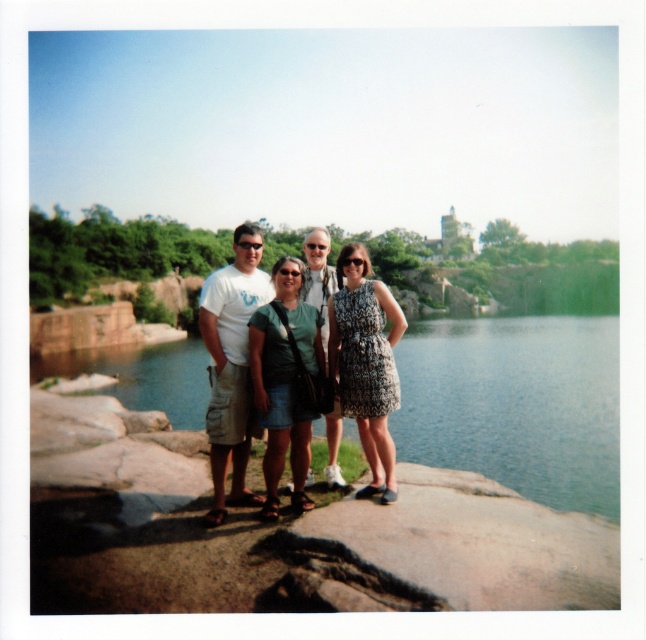
Is matte green dress at center shorter than patterned fabric dress at center?

No, matte green dress at center is not shorter than patterned fabric dress at center.

Does point (222, 358) come farther from viewer compared to point (364, 397)?

Yes.

Which is in front, point (222, 483) or point (388, 312)?

Positioned in front is point (222, 483).

The width and height of the screenshot is (646, 640). Find the location of `matte green dress at center`. matte green dress at center is located at coordinates (236, 396).

Is point (118, 380) positioned behind point (337, 266)?

Yes.

Is point (198, 397) farther from viewer compared to point (382, 317)?

Yes, it is behind point (382, 317).

The width and height of the screenshot is (646, 640). What are the coordinates of `green water at lower center` in the screenshot? It's located at (516, 404).

This screenshot has width=646, height=640. What do you see at coordinates (236, 396) in the screenshot?
I see `matte green dress at center` at bounding box center [236, 396].

Does matte green dress at center appear over green fabric dress at center?

Indeed, matte green dress at center is positioned over green fabric dress at center.

Is point (224, 380) positioned after point (276, 452)?

Yes, it is behind point (276, 452).

The height and width of the screenshot is (640, 646). What are the coordinates of `matte green dress at center` in the screenshot? It's located at (236, 396).